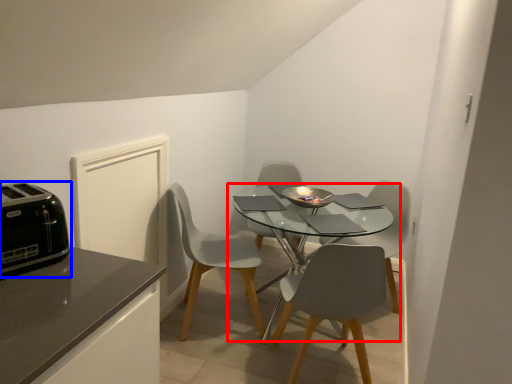
Question: Which object is further to the camera taking this photo, kitchen & dining room table (highlighted by a red box) or toaster (highlighted by a blue box)?

Choices:
 (A) kitchen & dining room table
 (B) toaster

Answer: (A)